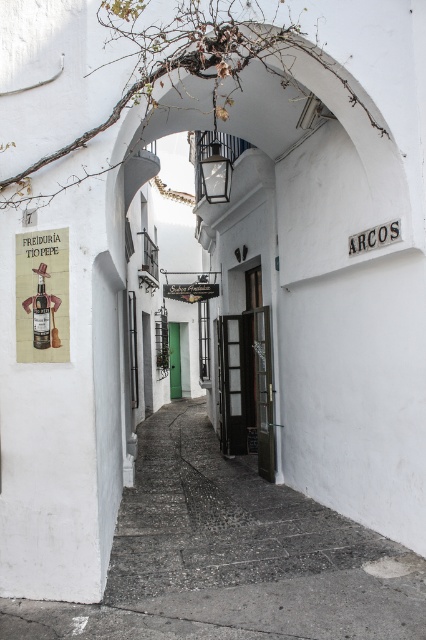
You are a tourist in a Mediterranean town and see the matte paper poster at left and the matte glass bottle at left. Which object is wider?

The matte paper poster at left is wider than the matte glass bottle at left according to the description.

You are standing in the street scene and want to read the text on the matte paper poster at left. Can you read the text clearly without moving closer?

The matte paper poster at left is 4.27 meters away from camera, so you can read the text clearly without moving closer.